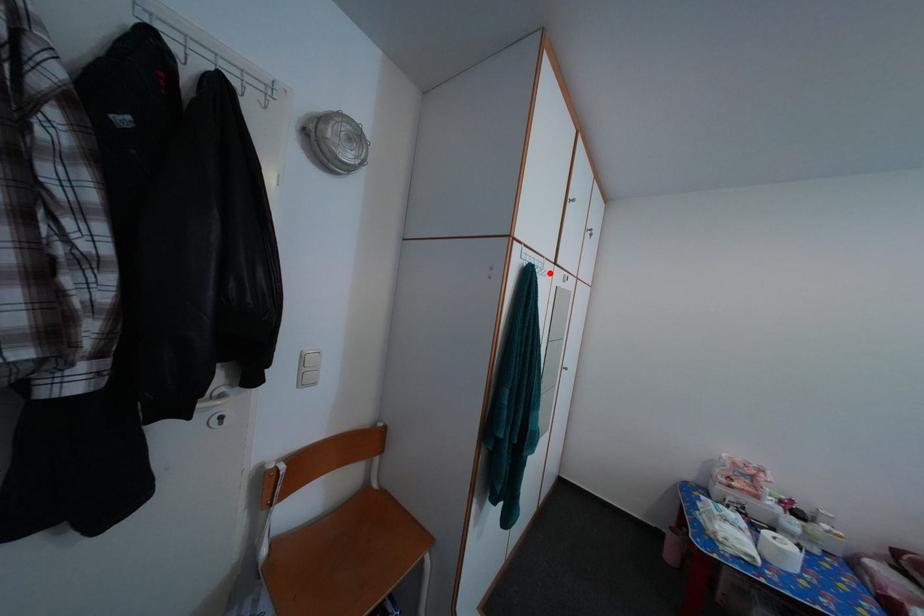
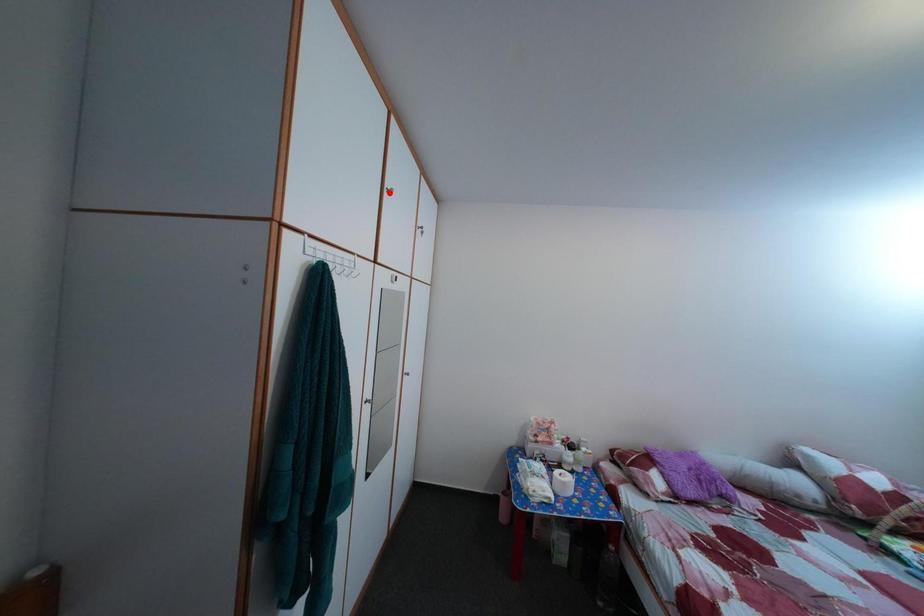
Consider the image. I am providing you with two images of the same scene from different viewpoints. A red point is marked on the first image and another point is marked on the second image. Are the points marked in image1 and image2 representing the same 3D position?

No